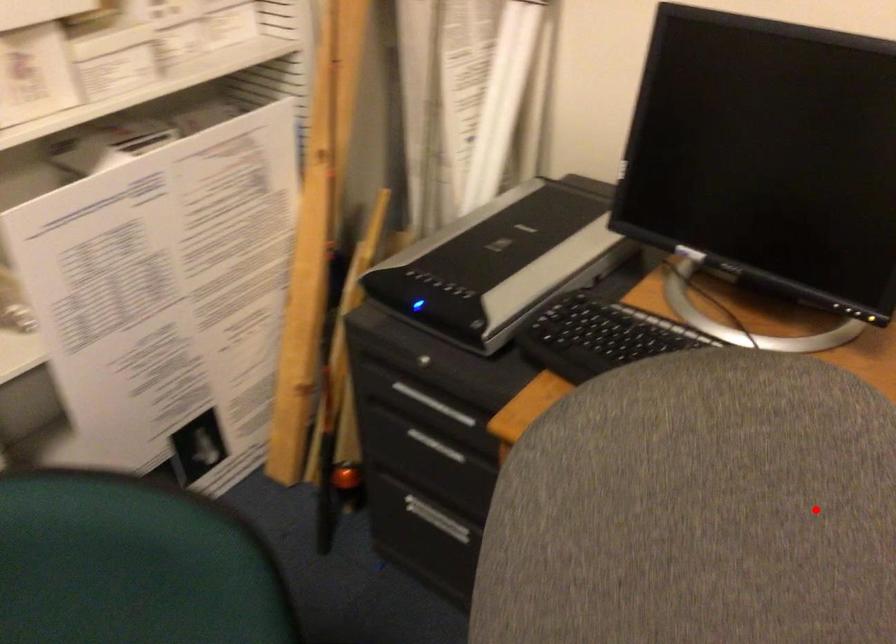
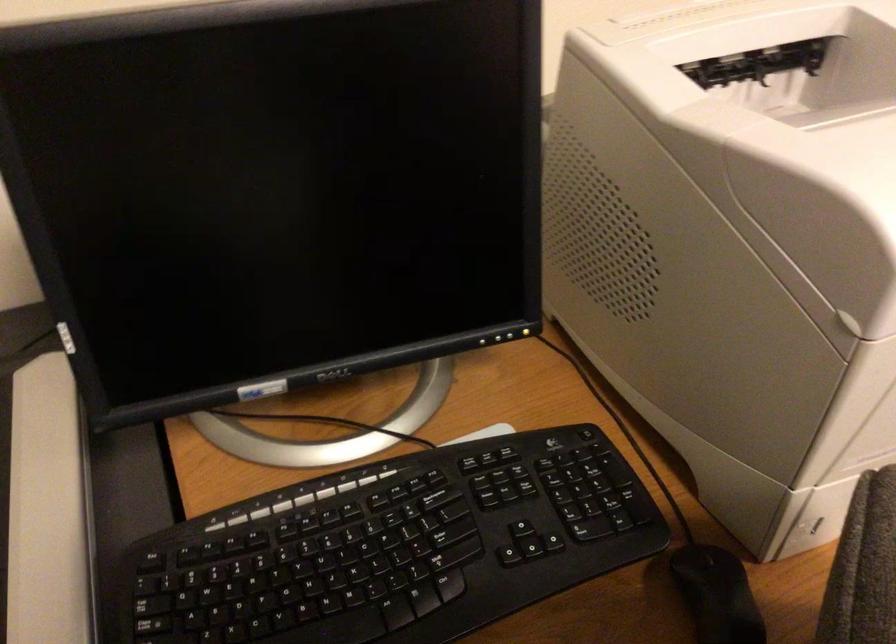
Find the pixel in the second image that matches the highlighted location in the first image.

(717, 594)